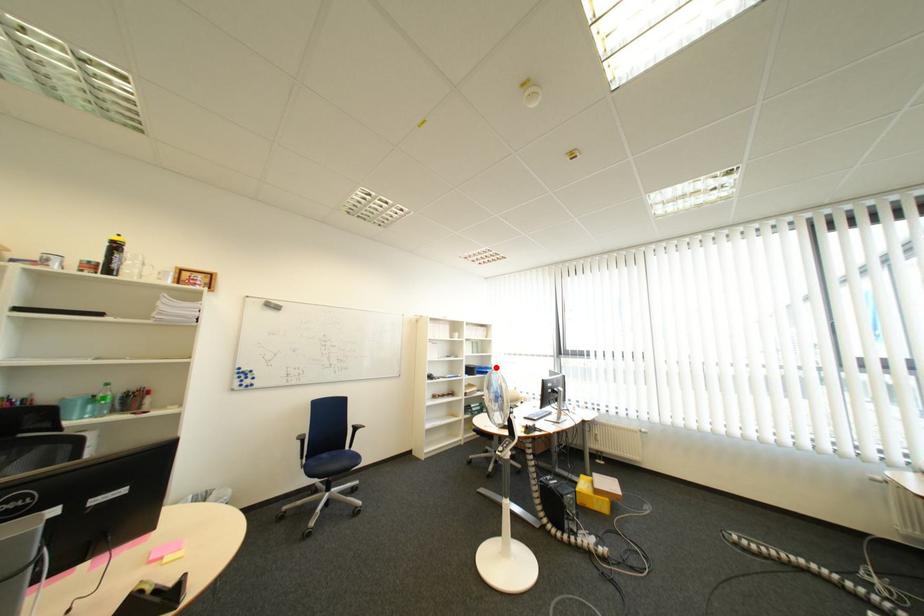
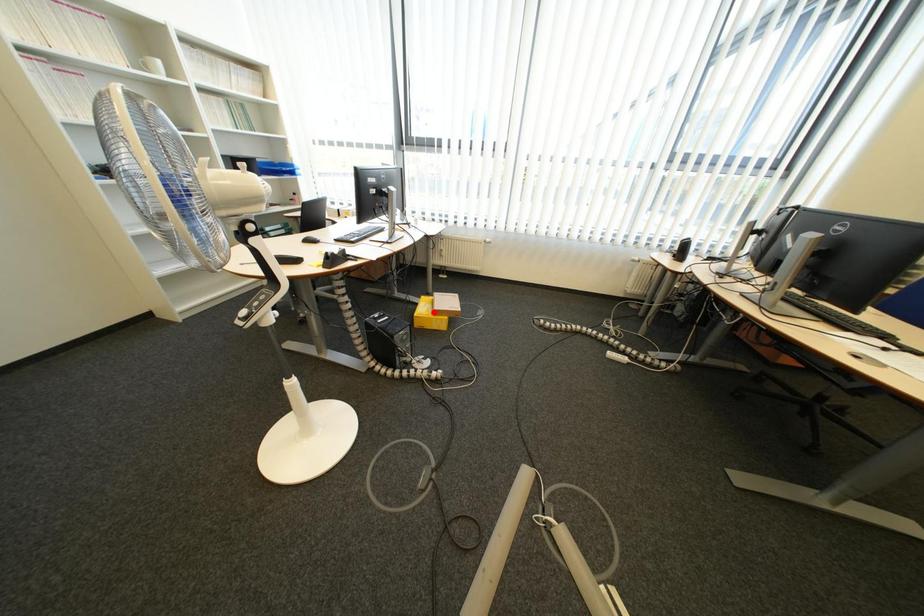
I am providing you with two images of the same scene from different viewpoints. A red point is marked on the first image and another point is marked on the second image. Are the points marked in image1 and image2 representing the same 3D position?

No